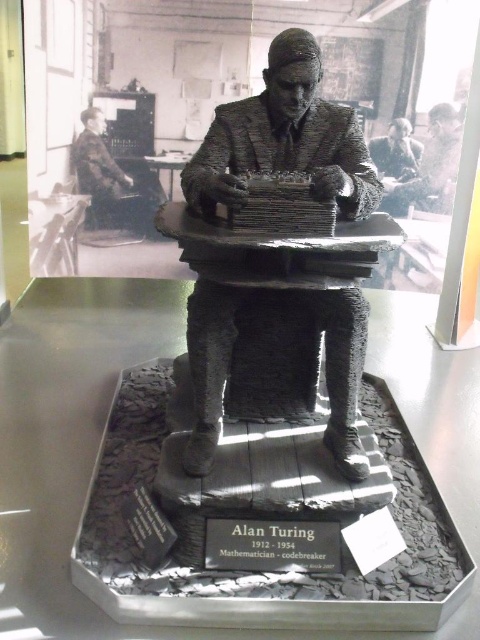
You are a museum curator planning to install a new spotlight above the Alan Turing sculpture. The spotlight needs to be positioned directly above the black stone plaque at center. Given the coordinates provided in the description, can you determine the exact coordinates where the spotlight should be placed?

The spotlight should be placed at the same coordinates as the black stone plaque at center, which is at point (272, 545), to ensure it is directly above the plaque.

You are a museum visitor standing in front of the Alan Turing miniature sculpture. You notice the bronze textured statue at center and the black stone plaque at center. Which object is positioned higher relative to the other?

The bronze textured statue at center is located above the black stone plaque at center, so it is positioned higher.